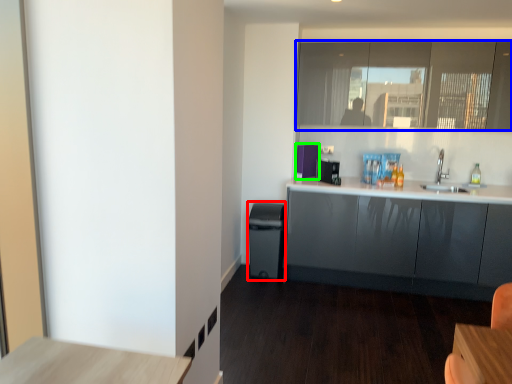
Question: Which object is the closest to the dish washer (highlighted by a red box)? Choose among these: window (highlighted by a blue box) or appliance (highlighted by a green box).

Choices:
 (A) window
 (B) appliance

Answer: (B)